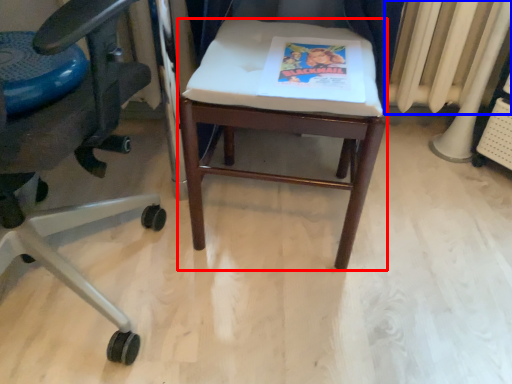
Question: Which object is closer to the camera taking this photo, stool (highlighted by a red box) or radiator (highlighted by a blue box)?

Choices:
 (A) stool
 (B) radiator

Answer: (A)